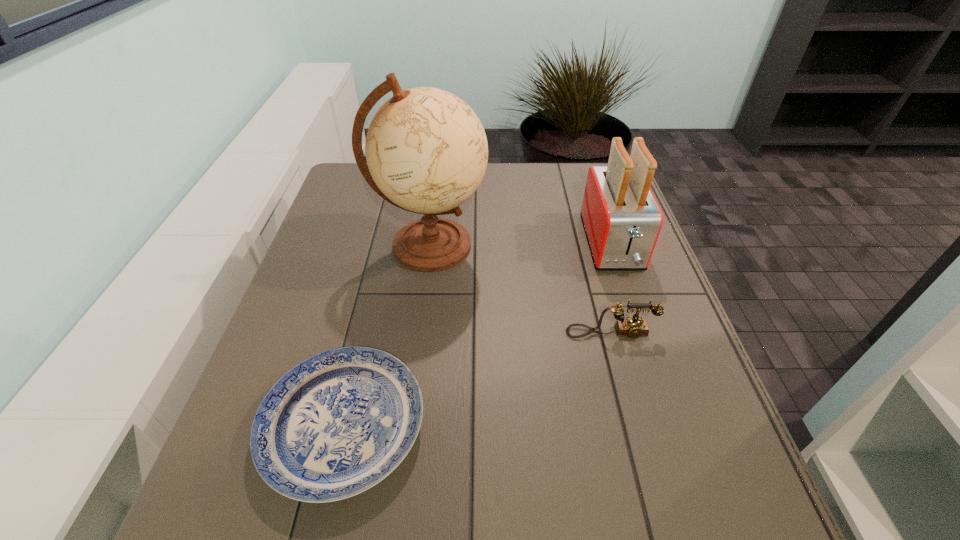
Identify which object is the closest to the toaster. Please provide its 2D coordinates. Your answer should be formatted as a tuple, i.e. [(x, y)], where the tuple contains the x and y coordinates of a point satisfying the conditions above.

[(633, 327)]

Locate an element on the screen. vacant space that satisfies the following two spatial constraints: 1. on the front-facing side of the toaster; 2. on the surface of the tallest object is located at coordinates (612, 246).

Image resolution: width=960 pixels, height=540 pixels. I want to click on free space that satisfies the following two spatial constraints: 1. on the front-facing side of the third shortest object; 2. on the surface of the globe, so click(612, 246).